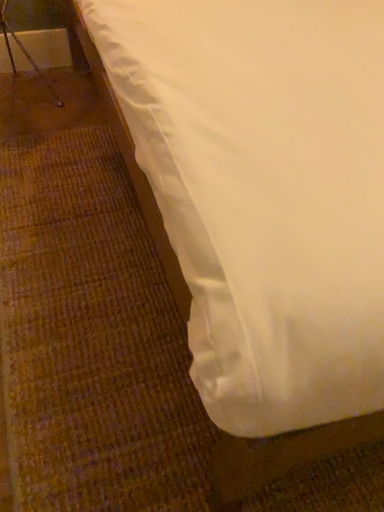
Where is `metallic silver swivel chair at left`? The image size is (384, 512). metallic silver swivel chair at left is located at coordinates pyautogui.click(x=23, y=52).

Looking at this image, in order to face metallic silver swivel chair at left, should I rotate leftwards or rightwards?

To align with it, rotate left about 21.976°.

The image size is (384, 512). Describe the element at coordinates (23, 52) in the screenshot. I see `metallic silver swivel chair at left` at that location.

Measure the distance between point (19, 42) and camera.

Point (19, 42) and camera are 6.49 feet apart.

What are the coordinates of `metallic silver swivel chair at left` in the screenshot? It's located at (23, 52).